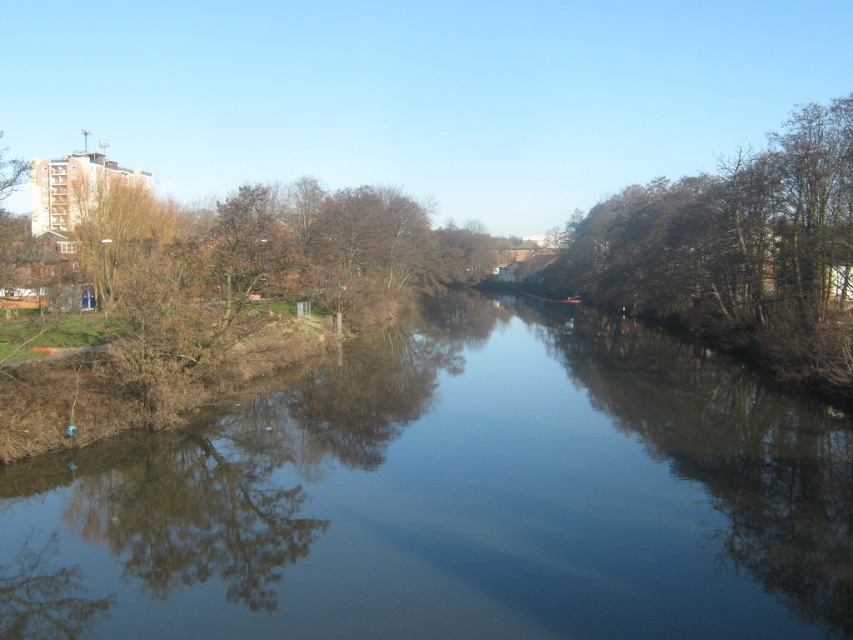
Question: Is transparent water at center wider than brown leafy tree at upper left?

Choices:
 (A) yes
 (B) no

Answer: (B)

Question: Estimate the real-world distances between objects in this image. Which object is farther from the brown leafy tree at right?

Choices:
 (A) transparent water at center
 (B) brown leafy tree at upper left

Answer: (B)

Question: Is brown leafy tree at right wider than brown leafy tree at upper left?

Choices:
 (A) no
 (B) yes

Answer: (B)

Question: Which is farther from the brown leafy tree at right?

Choices:
 (A) brown leafy tree at upper left
 (B) transparent water at center

Answer: (A)

Question: Estimate the real-world distances between objects in this image. Which object is farther from the brown leafy tree at right?

Choices:
 (A) brown leafy tree at upper left
 (B) transparent water at center

Answer: (A)

Question: Can you confirm if brown leafy tree at right is positioned to the left of brown leafy tree at upper left?

Choices:
 (A) no
 (B) yes

Answer: (A)